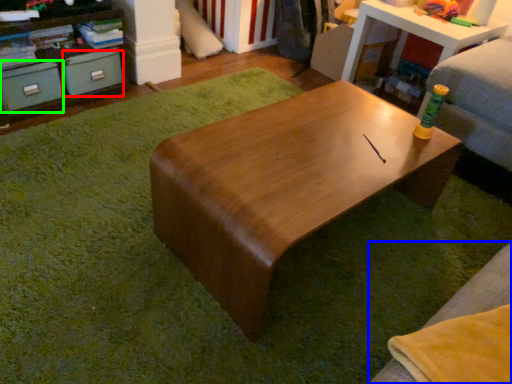
Question: Considering the real-world distances, which object is farthest from drawer (highlighted by a red box)? couch (highlighted by a blue box) or drawer (highlighted by a green box)?

Choices:
 (A) couch
 (B) drawer

Answer: (A)